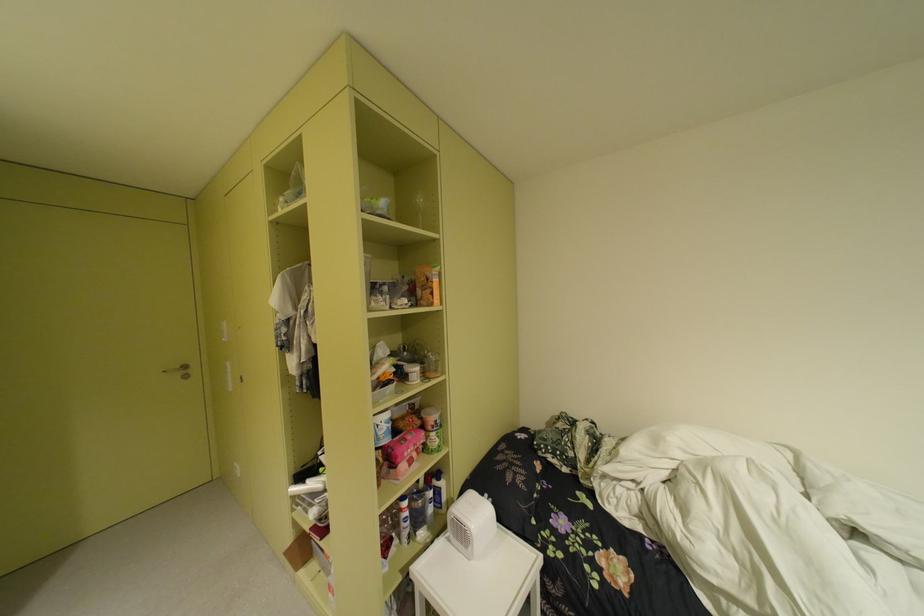
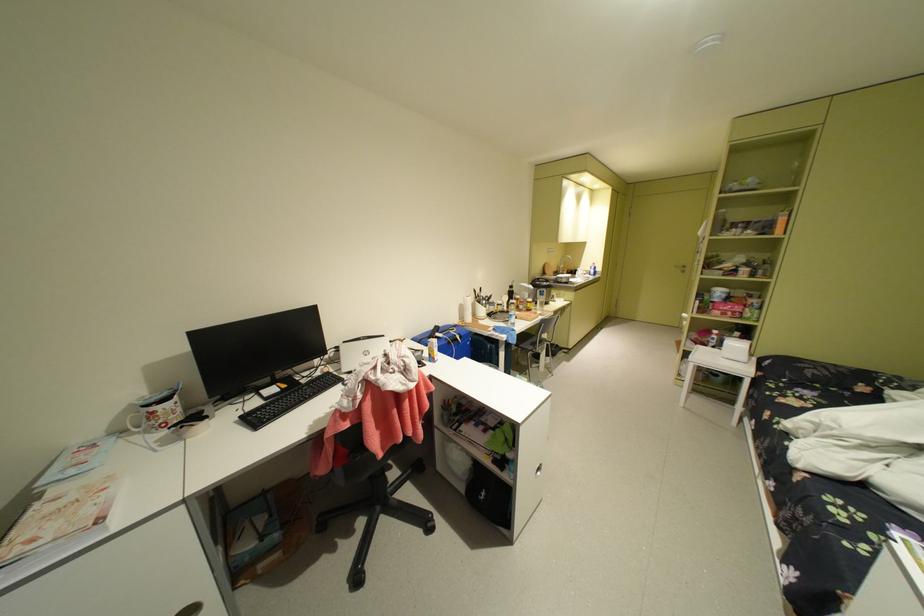
Find the pixel in the second image that matches point (419, 437) in the first image.

(740, 304)